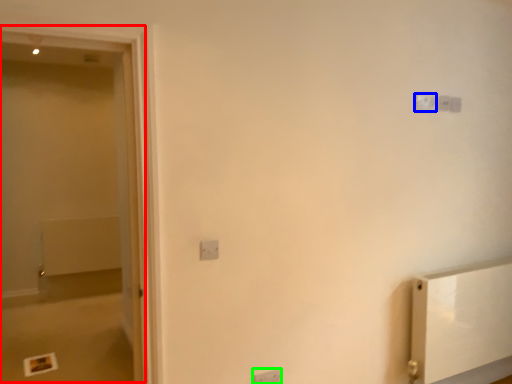
Question: Estimate the real-world distances between objects in this image. Which object is farther from screen door (highlighted by a red box), light switch (highlighted by a blue box) or light switch (highlighted by a green box)?

Choices:
 (A) light switch
 (B) light switch

Answer: (A)